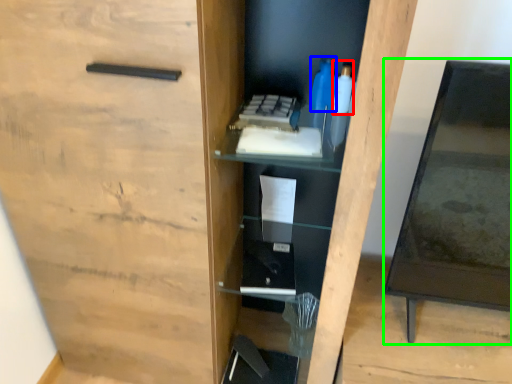
Question: Estimate the real-world distances between objects in this image. Which object is farther from bottle (highlighted by a red box), bottle (highlighted by a blue box) or table (highlighted by a green box)?

Choices:
 (A) bottle
 (B) table

Answer: (B)